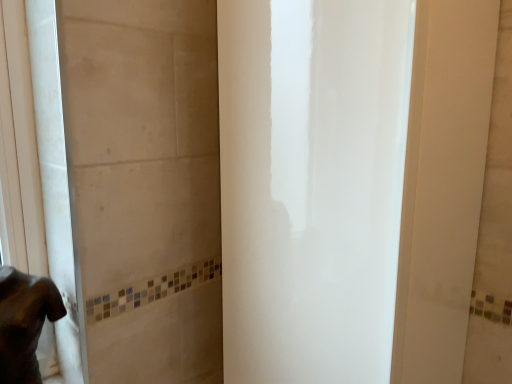
Identify the location of dark brown fur at lower left. (24, 322).

Describe the element at coordinates (24, 322) in the screenshot. I see `dark brown fur at lower left` at that location.

Locate an element on the screen. This screenshot has width=512, height=384. white glossy screen door at center is located at coordinates (311, 185).

Measure the distance between point (378, 138) and camera.

Point (378, 138) and camera are 60.80 centimeters apart.

The width and height of the screenshot is (512, 384). Describe the element at coordinates (311, 185) in the screenshot. I see `white glossy screen door at center` at that location.

Locate an element on the screen. Image resolution: width=512 pixels, height=384 pixels. dark brown fur at lower left is located at coordinates pyautogui.click(x=24, y=322).

Looking at this image, which object is positioned more to the left, dark brown fur at lower left or white glossy screen door at center?

From the viewer's perspective, dark brown fur at lower left appears more on the left side.

Which object is further away from the camera taking this photo, dark brown fur at lower left or white glossy screen door at center?

dark brown fur at lower left.

Does point (16, 277) come in front of point (261, 269)?

Yes, point (16, 277) is closer to viewer.

From the image's perspective, between dark brown fur at lower left and white glossy screen door at center, who is located below?

dark brown fur at lower left appears lower in the image.

From a real-world perspective, between dark brown fur at lower left and white glossy screen door at center, who is vertically lower?

dark brown fur at lower left.

Is dark brown fur at lower left wider or thinner than white glossy screen door at center?

Considering their sizes, dark brown fur at lower left looks slimmer than white glossy screen door at center.

In terms of height, does dark brown fur at lower left look taller or shorter compared to white glossy screen door at center?

dark brown fur at lower left is shorter than white glossy screen door at center.

Looking at this image, considering the sizes of objects dark brown fur at lower left and white glossy screen door at center in the image provided, who is bigger, dark brown fur at lower left or white glossy screen door at center?

white glossy screen door at center.

Does dark brown fur at lower left contain white glossy screen door at center?

No, dark brown fur at lower left does not contain white glossy screen door at center.

Is dark brown fur at lower left not near white glossy screen door at center?

No, there isn't a large distance between dark brown fur at lower left and white glossy screen door at center.

Is dark brown fur at lower left oriented away from white glossy screen door at center?

No.

How different are the orientations of dark brown fur at lower left and white glossy screen door at center in degrees?

There is a 61-degree angle between the facing directions of dark brown fur at lower left and white glossy screen door at center.

Find the location of a particular element. The height and width of the screenshot is (384, 512). screen door on the right of dark brown fur at lower left is located at coordinates (311, 185).

Which object is positioned more to the left, white glossy screen door at center or dark brown fur at lower left?

dark brown fur at lower left.

Which object is closer to the camera taking this photo, white glossy screen door at center or dark brown fur at lower left?

white glossy screen door at center.

Which is farther from the camera, (x=261, y=293) or (x=6, y=376)?

The point (x=261, y=293) is farther from the camera.

From the image's perspective, which one is positioned lower, white glossy screen door at center or dark brown fur at lower left?

dark brown fur at lower left is shown below in the image.

From a real-world perspective, which is physically below, white glossy screen door at center or dark brown fur at lower left?

dark brown fur at lower left is physically lower.

Looking at their sizes, would you say white glossy screen door at center is wider or thinner than dark brown fur at lower left?

white glossy screen door at center is wider than dark brown fur at lower left.

Is white glossy screen door at center taller than dark brown fur at lower left?

Correct, white glossy screen door at center is much taller as dark brown fur at lower left.

Considering the sizes of objects white glossy screen door at center and dark brown fur at lower left in the image provided, who is bigger, white glossy screen door at center or dark brown fur at lower left?

With larger size is white glossy screen door at center.

Is white glossy screen door at center located outside dark brown fur at lower left?

Yes, white glossy screen door at center is located beyond the bounds of dark brown fur at lower left.

Consider the image. Would you say white glossy screen door at center is a long distance from dark brown fur at lower left?

white glossy screen door at center is near dark brown fur at lower left, not far away.

Is white glossy screen door at center oriented towards dark brown fur at lower left?

No, white glossy screen door at center is not facing towards dark brown fur at lower left.

How many degrees apart are the facing directions of white glossy screen door at center and dark brown fur at lower left?

There is a 61-degree angle between the facing directions of white glossy screen door at center and dark brown fur at lower left.

This screenshot has height=384, width=512. What are the coordinates of `person lying behind the white glossy screen door at center` in the screenshot? It's located at (24, 322).

Locate an element on the screen. person located on the left of white glossy screen door at center is located at coordinates (24, 322).

Identify the location of screen door on the right of dark brown fur at lower left. 311,185.